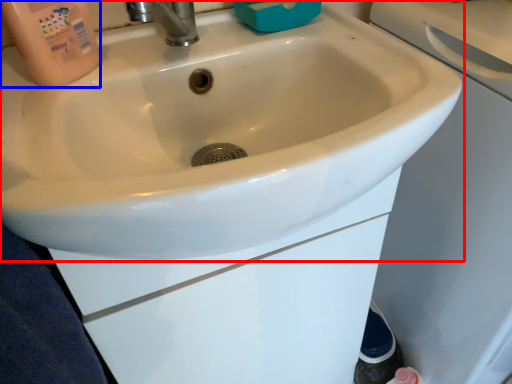
Question: Which object appears closest to the camera in this image, sink (highlighted by a red box) or cleaning product (highlighted by a blue box)?

Choices:
 (A) sink
 (B) cleaning product

Answer: (A)